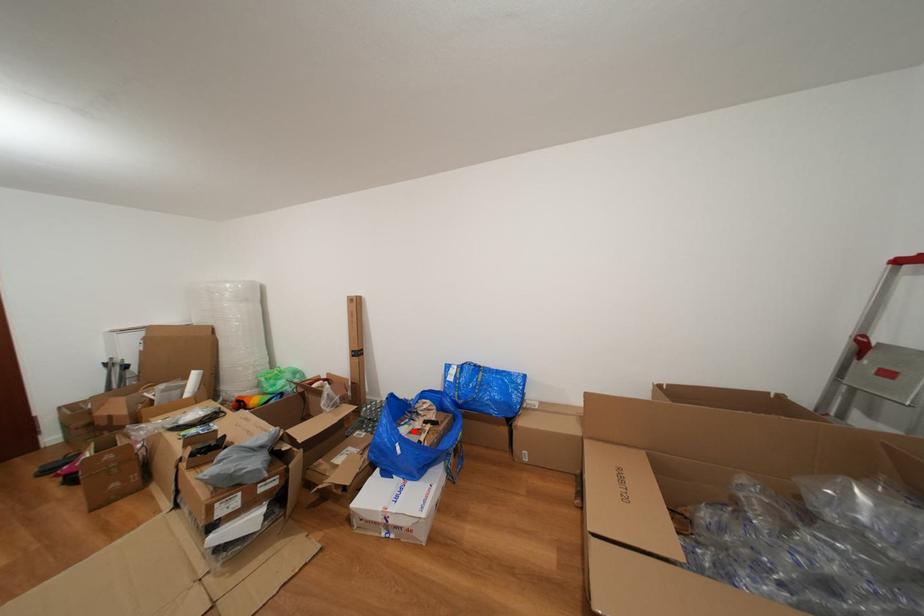
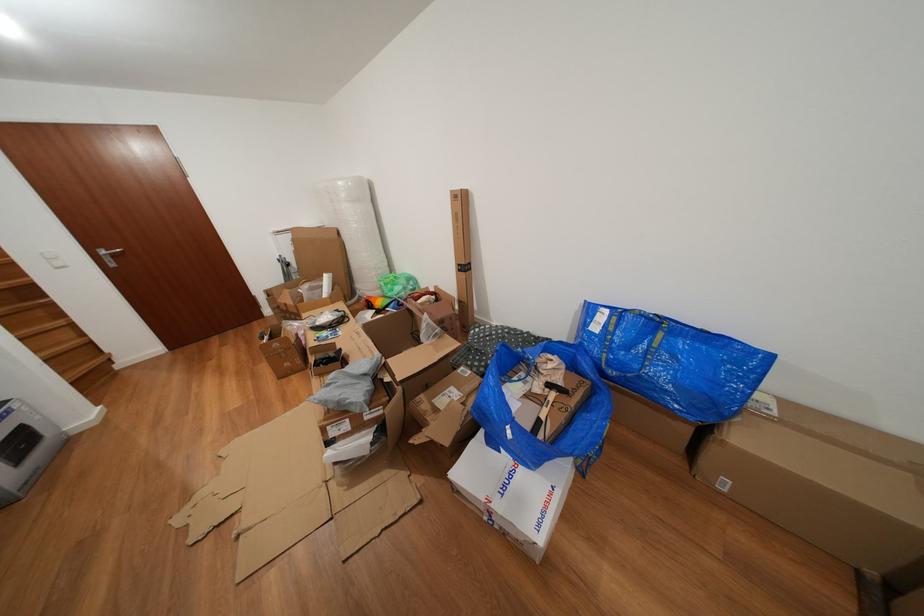
In the second image, find the point that corresponds to the highlighted location in the first image.

(529, 389)